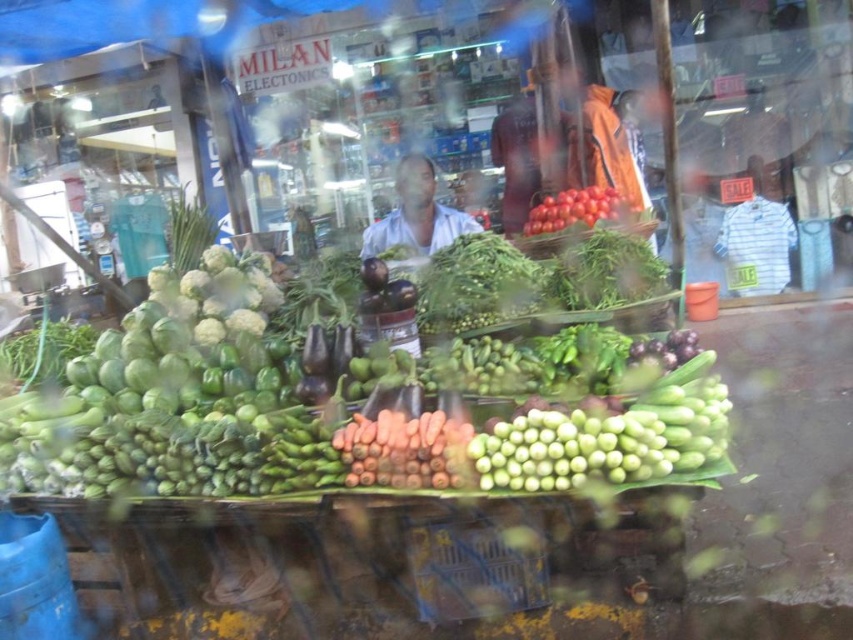
You are a customer at the market and want to find the green matte eggplant at center. According to the coordinates provided, where exactly should you look on the glass surface?

The green matte eggplant at center is located at the 2D coordinates point (370, 392) on the glass surface.

In the scene shown: You are a customer at the market and want to buy both the green matte eggplant at center and the orange matte carrots at center. If you first pick up the item on the left, which one will you pick first?

The green matte eggplant at center is to the left of the orange matte carrots at center, so you will pick up the green matte eggplant at center first.

You are a customer at the market and want to compare the two shirts displayed at the center. Which one is taller between the matte orange shirt at center and the white fabric shirt at center?

The matte orange shirt at center has a greater height compared to the white fabric shirt at center.